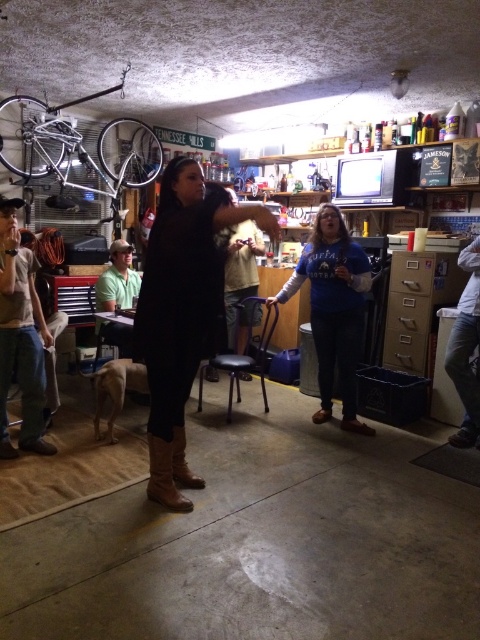
You are a photographer trying to capture a photo of the brushed metal shirt at left and fuzzy beige sweater at center. Which object should you focus on first if you want to include both in your frame without moving the camera?

The brushed metal shirt at left is much taller than the fuzzy beige sweater at center, so you should focus on the brushed metal shirt at left first to ensure it fits within the frame.

Consider the image. You are organizing a clothing donation drive and need to stack the brushed metal shirt at left and fuzzy beige sweater at center vertically. Which one should be placed at the bottom to ensure stability?

The brushed metal shirt at left should be placed at the bottom because it is located below the fuzzy beige sweater at center in the image, indicating it might be heavier or more stable.

You are organizing a small event in this garage and need to place a 1.2 meter wide table between the fuzzy beige sweater at center and the brown suede boot at center. Can the table fit between them?

The fuzzy beige sweater at center might be wider than brown suede boot at center. However, the description does not provide exact measurements of their widths or the distance between them. Without specific spatial details like the distance between the two objects or their actual widths, it is impossible to determine if the 1.2 meter wide table can fit between them.